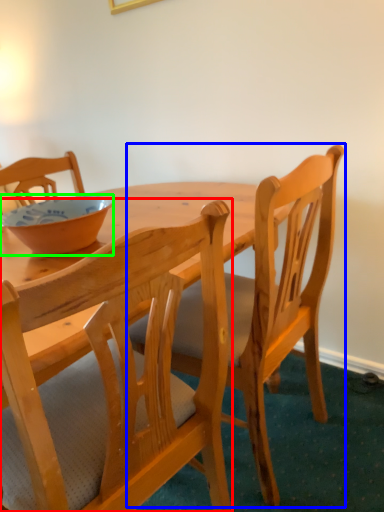
Question: Based on their relative distances, which object is farther from chair (highlighted by a red box)? Choose from chair (highlighted by a blue box) and bowl (highlighted by a green box).

Choices:
 (A) chair
 (B) bowl

Answer: (B)